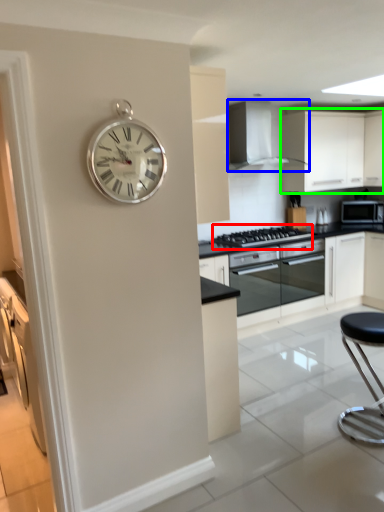
Question: Which object is positioned closest to gas stove (highlighted by a red box)? Select from home appliance (highlighted by a blue box) and cabinetry (highlighted by a green box).

Choices:
 (A) home appliance
 (B) cabinetry

Answer: (A)